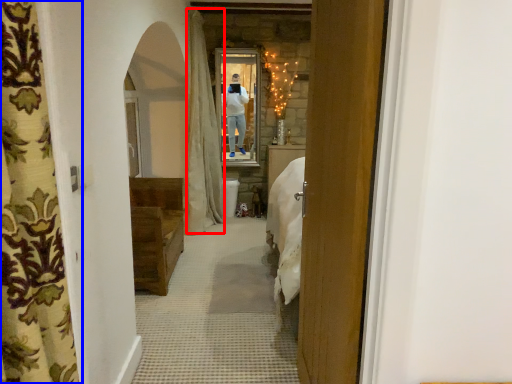
Question: Which of the following is the closest to the observer, curtain (highlighted by a red box) or curtain (highlighted by a blue box)?

Choices:
 (A) curtain
 (B) curtain

Answer: (B)